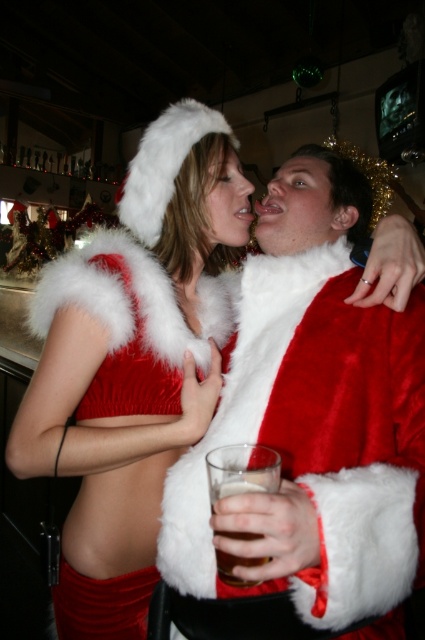
You are a photographer at a holiday party. You want to capture a photo of the velvet santa coat at center and the velvet red dress at center. The camera you are using has a minimum focus distance of 20 centimeters. Can you take a photo of both objects without moving them?

The distance between the velvet santa coat at center and the velvet red dress at center is 19.56 centimeters, which is less than the camera minimum focus distance of 20 centimeters. Therefore, you cannot take a photo of both objects without moving them.

You are at a holiday party and want to take a photo of both individuals in their Santa costumes. You notice two points marked in the image. The first point is at coordinate point(x=172, y=477) and the second at point(x=212, y=497). If you want to ensure both Santa figures are fully visible in your photo, which point should you stand behind to frame them best?

You should stand behind point(x=172, y=477) because it is behind point(x=212, y=497), allowing you to see both Santa figures clearly without obstruction.

You are a photographer at a holiday party. You need to capture a shot of the velvet red dress at center and the brown translucent glass at center. Based on their positions, which object is closer to the camera?

The velvet red dress at center is above the brown translucent glass at center, which means it is closer to the camera.